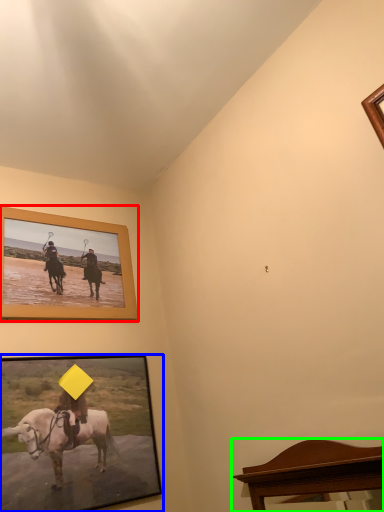
Question: Which object is the farthest from picture frame (highlighted by a red box)? Choose among these: picture frame (highlighted by a blue box) or furniture (highlighted by a green box).

Choices:
 (A) picture frame
 (B) furniture

Answer: (B)